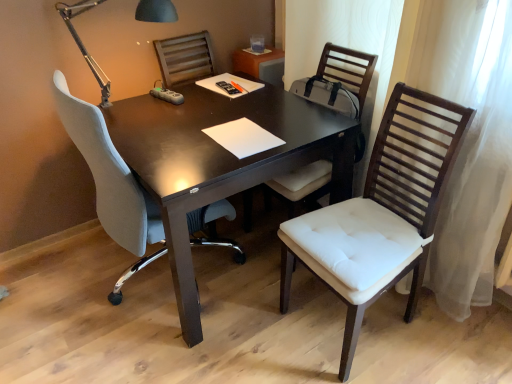
Image resolution: width=512 pixels, height=384 pixels. In order to click on space that is in front of white paper at center in this screenshot , I will do `click(214, 163)`.